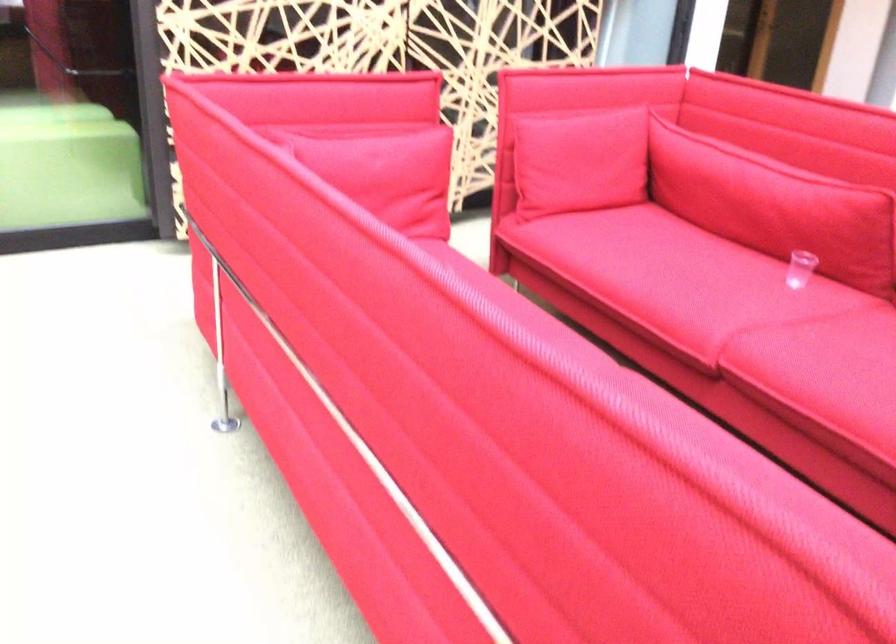
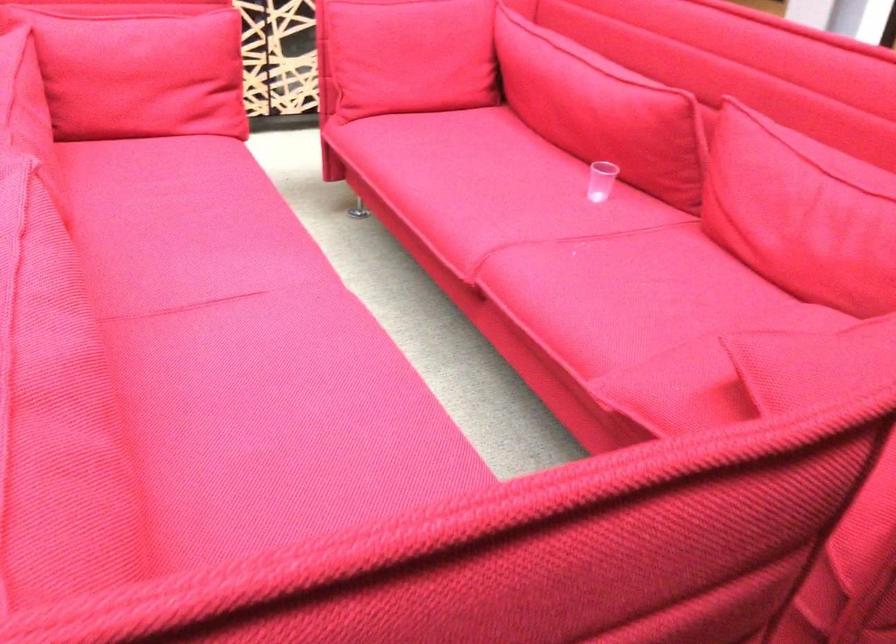
The point at (367, 194) is marked in the first image. Where is the corresponding point in the second image?

(142, 76)